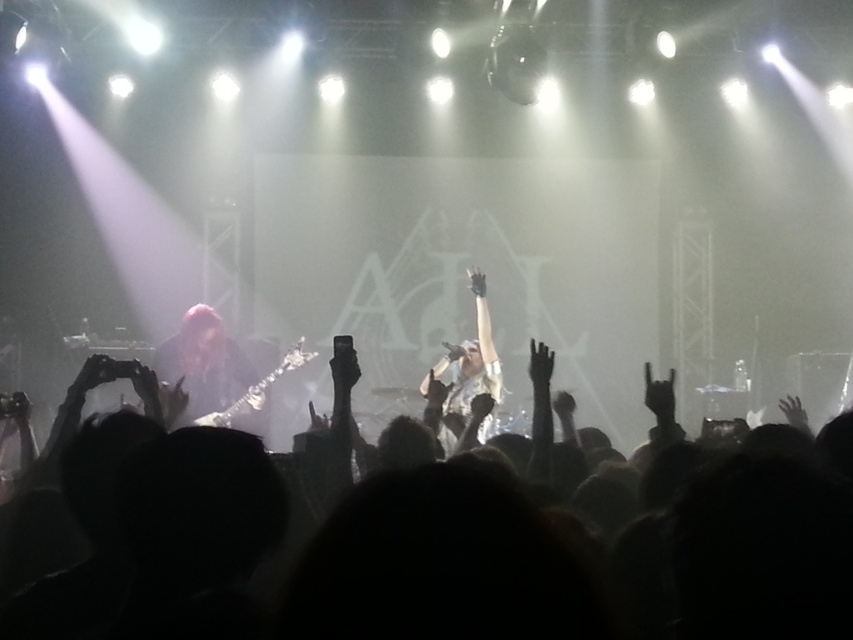
How distant is silhouette crowd at center from shiny silver microphone at center?

A distance of 2.64 meters exists between silhouette crowd at center and shiny silver microphone at center.

Is silhouette crowd at center behind shiny silver microphone at center?

No, silhouette crowd at center is in front of shiny silver microphone at center.

Is point (785, 467) farther from viewer compared to point (488, 324)?

No, (785, 467) is in front of (488, 324).

At what (x,y) coordinates should I click in order to perform the action: click on silhouette crowd at center. Please return your answer as a coordinate pair (x, y). This screenshot has width=853, height=640. Looking at the image, I should click on (438, 564).

Is silhouette crowd at center wider than shiny red hair at left?

Yes, silhouette crowd at center is wider than shiny red hair at left.

Is point (469, 588) positioned before point (184, 372)?

Yes.

Which is behind, point (804, 531) or point (230, 394)?

The point (230, 394) is more distant.

At what (x,y) coordinates should I click in order to perform the action: click on silhouette crowd at center. Please return your answer as a coordinate pair (x, y). The height and width of the screenshot is (640, 853). Looking at the image, I should click on (x=438, y=564).

Who is higher up, shiny red hair at left or shiny silver microphone at center?

shiny silver microphone at center

Is shiny red hair at left taller than shiny silver microphone at center?

In fact, shiny red hair at left may be shorter than shiny silver microphone at center.

Is point (180, 387) less distant than point (480, 308)?

Yes, it is in front of point (480, 308).

The height and width of the screenshot is (640, 853). What are the coordinates of `shiny red hair at left` in the screenshot? It's located at (202, 362).